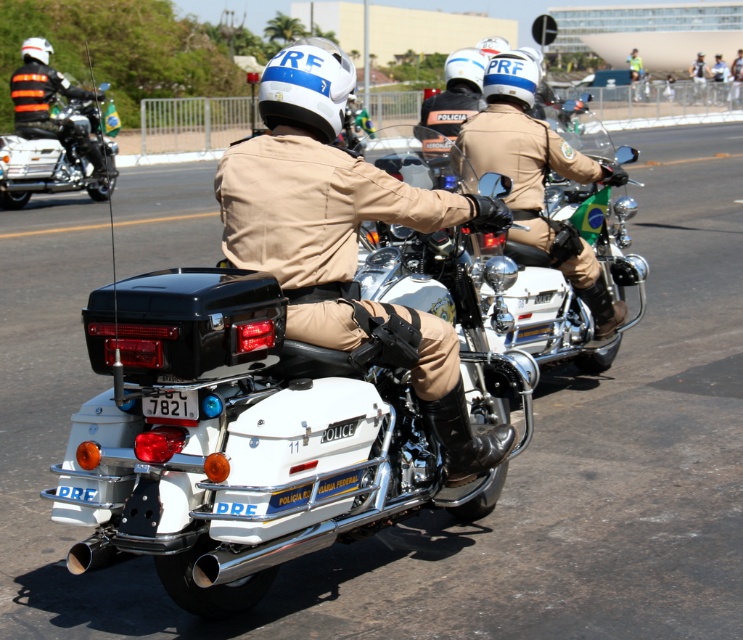
You are a photographer trying to capture both the matte black helmet at upper center and the matte black motorcycle at left in a single frame. Based on their sizes in the image, which object would you need to position closer to the camera to ensure both fit within the frame?

The matte black helmet at upper center occupies less space than the matte black motorcycle at left, so you should position the matte black helmet at upper center closer to the camera to ensure both fit within the frame.